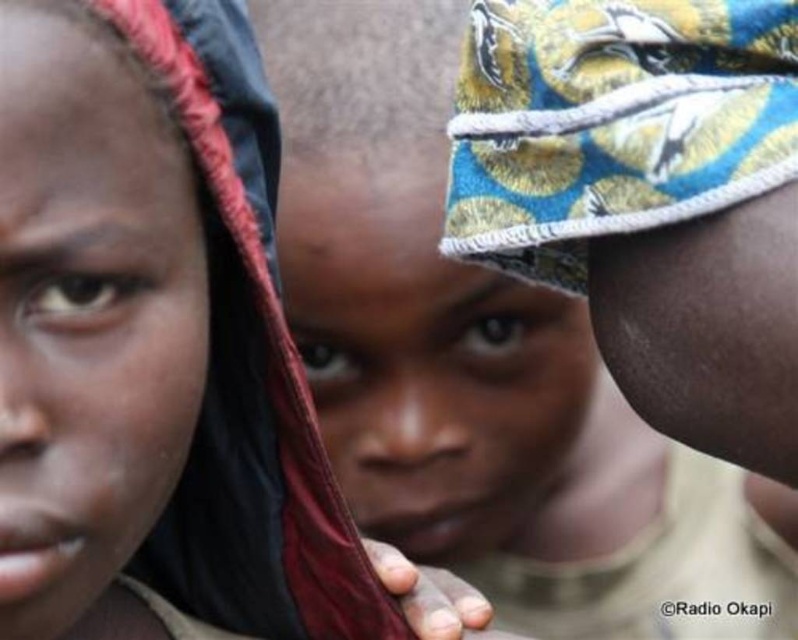
Question: Among these objects, which one is nearest to the camera?

Choices:
 (A) matte black headscarf at left
 (B) matte fabric headscarf at center

Answer: (A)

Question: Is matte fabric headscarf at center wider than matte black headscarf at left?

Choices:
 (A) yes
 (B) no

Answer: (A)

Question: Which point is closer to the camera taking this photo?

Choices:
 (A) (293, 173)
 (B) (309, 612)

Answer: (B)

Question: Which point is farther from the camera taking this photo?

Choices:
 (A) (407, 385)
 (B) (255, 371)

Answer: (A)

Question: Can you confirm if matte fabric headscarf at center is positioned below matte black headscarf at left?

Choices:
 (A) yes
 (B) no

Answer: (B)

Question: Is matte fabric headscarf at center thinner than matte black headscarf at left?

Choices:
 (A) no
 (B) yes

Answer: (A)